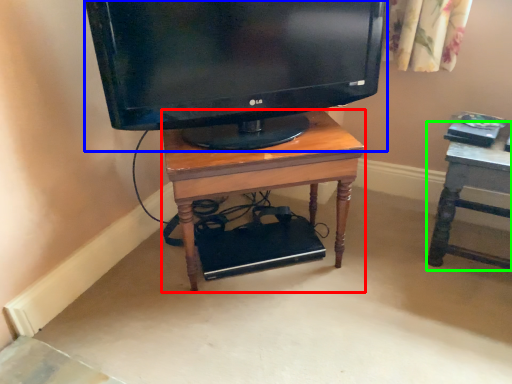
Question: Considering the real-world distances, which object is farthest from desk (highlighted by a red box)? television (highlighted by a blue box) or furniture (highlighted by a green box)?

Choices:
 (A) television
 (B) furniture

Answer: (B)